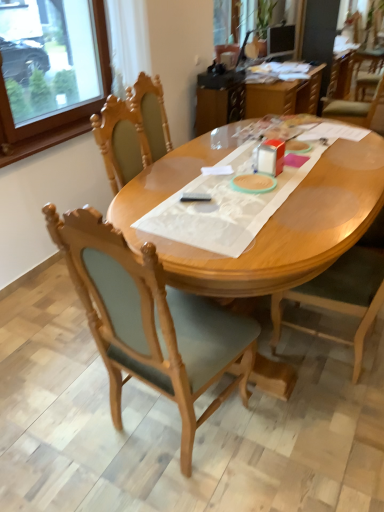
What do you see at coordinates (256, 100) in the screenshot? The width and height of the screenshot is (384, 512). I see `translucent plastic table at upper center` at bounding box center [256, 100].

Where is `wooden chair at center, the 2th chair viewed from the left`? The image size is (384, 512). wooden chair at center, the 2th chair viewed from the left is located at coordinates (343, 290).

From the image's perspective, is wooden chair at center, placed as the 1th chair when sorted from right to left, above or below wooden frame at upper left?

wooden chair at center, placed as the 1th chair when sorted from right to left, is situated lower than wooden frame at upper left in the image.

Based on the photo, from a real-world perspective, between wooden chair at center, the 2th chair viewed from the left, and wooden frame at upper left, who is vertically lower?

wooden chair at center, the 2th chair viewed from the left, from a real-world perspective.

Can you confirm if wooden chair at center, the 2th chair viewed from the left, is shorter than wooden frame at upper left?

No, wooden chair at center, the 2th chair viewed from the left, is not shorter than wooden frame at upper left.

From a real-world perspective, is wooden chair at center, which is counted as the 2th chair, starting from the right, below wooden chair at center, the 2th chair viewed from the left?

Actually, wooden chair at center, which is counted as the 2th chair, starting from the right, is physically above wooden chair at center, the 2th chair viewed from the left, in the real world.

This screenshot has height=512, width=384. Find the location of `chair on the left of wooden chair at center, placed as the 1th chair when sorted from right to left`. chair on the left of wooden chair at center, placed as the 1th chair when sorted from right to left is located at coordinates (151, 322).

Is wooden chair at center, placed as the 1th chair when sorted from left to right, to the left or to the right of wooden chair at center, the 2th chair viewed from the left, in the image?

In the image, wooden chair at center, placed as the 1th chair when sorted from left to right, appears on the left side of wooden chair at center, the 2th chair viewed from the left.

Can you confirm if wooden chair at center, placed as the 1th chair when sorted from left to right, is shorter than light brown wood desk at center?

No.

Is wooden chair at center, placed as the 1th chair when sorted from left to right, not near light brown wood desk at center?

Actually, wooden chair at center, placed as the 1th chair when sorted from left to right, and light brown wood desk at center are a little close together.

Considering the positions of points (93, 277) and (169, 191), is point (93, 277) farther from camera compared to point (169, 191)?

No, it is in front of (169, 191).

Image resolution: width=384 pixels, height=512 pixels. What are the coordinates of `the 1st chair in front of the translucent plastic table at upper center` in the screenshot? It's located at (343, 290).

Looking at this image, based on their positions, is wooden chair at center, placed as the 1th chair when sorted from right to left, located to the left or right of translucent plastic table at upper center?

wooden chair at center, placed as the 1th chair when sorted from right to left, is positioned on translucent plastic table at upper center's left side.

Could you measure the distance between wooden chair at center, the 2th chair viewed from the left, and translucent plastic table at upper center?

wooden chair at center, the 2th chair viewed from the left, and translucent plastic table at upper center are 7.10 feet apart.

Does wooden frame at upper left contain translucent plastic table at upper center?

No, translucent plastic table at upper center is not surrounded by wooden frame at upper left.

Can you confirm if wooden frame at upper left is bigger than translucent plastic table at upper center?

Actually, wooden frame at upper left might be smaller than translucent plastic table at upper center.

Which object is positioned more to the left, wooden frame at upper left or translucent plastic table at upper center?

wooden frame at upper left is more to the left.

Which point is more forward, (38, 122) or (197, 115)?

The point (38, 122) is more forward.

Is light brown wood desk at center inside or outside of translucent plastic table at upper center?

light brown wood desk at center is outside translucent plastic table at upper center.

Which is further, (x=225, y=127) or (x=206, y=119)?

The point (x=206, y=119) is farther from the camera.

Is light brown wood desk at center closer to camera compared to translucent plastic table at upper center?

Yes, light brown wood desk at center is closer to the viewer.

Which of these two, light brown wood desk at center or translucent plastic table at upper center, is thinner?

translucent plastic table at upper center is thinner.

From the image's perspective, between wooden frame at upper left and wooden chair at center, which is counted as the 2th chair, starting from the right, who is located below?

wooden chair at center, which is counted as the 2th chair, starting from the right.

Does wooden frame at upper left appear on the left side of wooden chair at center, which is counted as the 2th chair, starting from the right?

Yes, wooden frame at upper left is to the left of wooden chair at center, which is counted as the 2th chair, starting from the right.

Could you measure the distance between wooden frame at upper left and wooden chair at center, placed as the 1th chair when sorted from left to right?

wooden frame at upper left and wooden chair at center, placed as the 1th chair when sorted from left to right, are 5.71 feet apart.

Which of these two, wooden frame at upper left or wooden chair at center, placed as the 1th chair when sorted from left to right, is wider?

With larger width is wooden chair at center, placed as the 1th chair when sorted from left to right.

From a real-world perspective, count 2nd chairs downward from the wooden frame at upper left and point to it. Please provide its 2D coordinates.

[(343, 290)]

Identify the location of chair behind the wooden chair at center, which is counted as the 2th chair, starting from the right. The width and height of the screenshot is (384, 512). (343, 290).

Considering their positions, is wooden frame at upper left positioned closer to light brown wood desk at center than wooden chair at center, placed as the 1th chair when sorted from left to right?

wooden chair at center, placed as the 1th chair when sorted from left to right, lies closer to light brown wood desk at center than the other object.

Estimate the real-world distances between objects in this image. Which object is further from wooden chair at center, which is counted as the 2th chair, starting from the right, wooden frame at upper left or wooden chair at center, placed as the 1th chair when sorted from right to left?

wooden frame at upper left.

Based on their spatial positions, is translucent plastic table at upper center or wooden chair at center, placed as the 1th chair when sorted from left to right, closer to wooden chair at center, placed as the 1th chair when sorted from right to left?

wooden chair at center, placed as the 1th chair when sorted from left to right, is closer to wooden chair at center, placed as the 1th chair when sorted from right to left.

Considering their positions, is translucent plastic table at upper center positioned further to wooden frame at upper left than light brown wood desk at center?

Based on the image, light brown wood desk at center appears to be further to wooden frame at upper left.

When comparing their distances from wooden chair at center, which is counted as the 2th chair, starting from the right, does wooden chair at center, placed as the 1th chair when sorted from right to left, or light brown wood desk at center seem further?

wooden chair at center, placed as the 1th chair when sorted from right to left, is further to wooden chair at center, which is counted as the 2th chair, starting from the right.

Looking at the image, which one is located further to translucent plastic table at upper center, wooden chair at center, which is counted as the 2th chair, starting from the right, or wooden chair at center, the 2th chair viewed from the left?

wooden chair at center, which is counted as the 2th chair, starting from the right.

Estimate the real-world distances between objects in this image. Which object is further from wooden chair at center, the 2th chair viewed from the left, wooden frame at upper left or light brown wood desk at center?

Based on the image, wooden frame at upper left appears to be further to wooden chair at center, the 2th chair viewed from the left.

When comparing their distances from wooden frame at upper left, does wooden chair at center, which is counted as the 2th chair, starting from the right, or light brown wood desk at center seem closer?

Among the two, light brown wood desk at center is located nearer to wooden frame at upper left.

Where is `chair positioned between light brown wood desk at center and translucent plastic table at upper center from near to far`? The height and width of the screenshot is (512, 384). chair positioned between light brown wood desk at center and translucent plastic table at upper center from near to far is located at coordinates (343, 290).

You are a GUI agent. You are given a task and a screenshot of the screen. Output one action in this format:
    pyautogui.click(x=<x>, y=<y>)
    Task: Click on the window frame between wooden chair at center, which is counted as the 2th chair, starting from the right, and translucent plastic table at upper center from front to back
    
    Given the screenshot: What is the action you would take?
    [50, 72]

Identify the location of window frame between wooden chair at center, the 2th chair viewed from the left, and translucent plastic table at upper center, along the z-axis. (50, 72).

Find the location of a particular element. Image resolution: width=384 pixels, height=512 pixels. desk between wooden frame at upper left and wooden chair at center, which is counted as the 2th chair, starting from the right, from top to bottom is located at coordinates (267, 221).